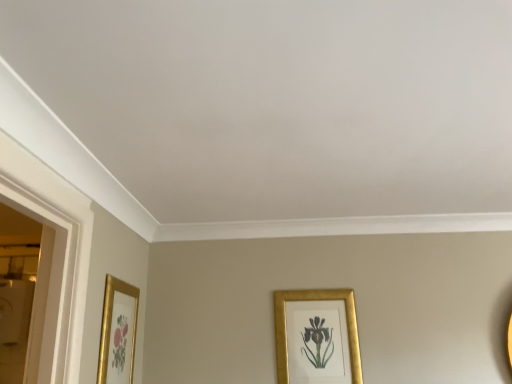
Question: Is gold metallic picture frame at lower center, placed as the 2th picture frame when sorted from left to right, far away from gold metallic picture frame at lower left, the 2th picture frame positioned from the back?

Choices:
 (A) yes
 (B) no

Answer: (B)

Question: From the image's perspective, would you say gold metallic picture frame at lower center, which is the 1th picture frame in right-to-left order, is positioned over gold metallic picture frame at lower left, the 2th picture frame positioned from the back?

Choices:
 (A) yes
 (B) no

Answer: (B)

Question: Does gold metallic picture frame at lower center, marked as the first picture frame in a back-to-front arrangement, have a lesser height compared to gold metallic picture frame at lower left, the 2th picture frame positioned from the back?

Choices:
 (A) yes
 (B) no

Answer: (B)

Question: From a real-world perspective, is gold metallic picture frame at lower center, which is the 1th picture frame in right-to-left order, located higher than gold metallic picture frame at lower left, the 1th picture frame viewed from the left?

Choices:
 (A) yes
 (B) no

Answer: (B)

Question: Is gold metallic picture frame at lower center, marked as the first picture frame in a back-to-front arrangement, beside gold metallic picture frame at lower left, arranged as the second picture frame when viewed from the right?

Choices:
 (A) yes
 (B) no

Answer: (B)

Question: Is gold metallic picture frame at lower center, placed as the 2th picture frame when sorted from left to right, further to camera compared to gold metallic picture frame at lower left, the 1th picture frame viewed from the left?

Choices:
 (A) no
 (B) yes

Answer: (B)

Question: From the image's perspective, is gold metallic picture frame at lower left, the 2th picture frame positioned from the back, on top of gold metallic picture frame at lower center, marked as the second picture frame in a front-to-back arrangement?

Choices:
 (A) no
 (B) yes

Answer: (B)

Question: Is gold metallic picture frame at lower left, the 1th picture frame viewed from the left, oriented away from gold metallic picture frame at lower center, which is the 1th picture frame in right-to-left order?

Choices:
 (A) no
 (B) yes

Answer: (A)

Question: Is gold metallic picture frame at lower left, arranged as the second picture frame when viewed from the right, shorter than gold metallic picture frame at lower center, marked as the first picture frame in a back-to-front arrangement?

Choices:
 (A) no
 (B) yes

Answer: (B)

Question: From a real-world perspective, is gold metallic picture frame at lower left, the 1th picture frame viewed from the left, located beneath gold metallic picture frame at lower center, marked as the first picture frame in a back-to-front arrangement?

Choices:
 (A) no
 (B) yes

Answer: (A)

Question: Is gold metallic picture frame at lower left, which ranks as the 1th picture frame in front-to-back order, to the left of gold metallic picture frame at lower center, marked as the first picture frame in a back-to-front arrangement, from the viewer's perspective?

Choices:
 (A) no
 (B) yes

Answer: (B)

Question: Can you confirm if gold metallic picture frame at lower left, the 2th picture frame positioned from the back, is taller than gold metallic picture frame at lower center, marked as the second picture frame in a front-to-back arrangement?

Choices:
 (A) no
 (B) yes

Answer: (A)

Question: Is gold metallic picture frame at lower left, which ranks as the 1th picture frame in front-to-back order, bigger or smaller than gold metallic picture frame at lower center, marked as the second picture frame in a front-to-back arrangement?

Choices:
 (A) big
 (B) small

Answer: (B)